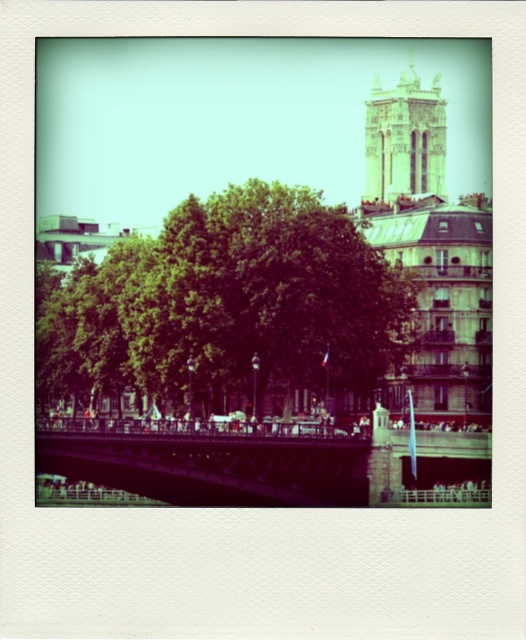
Is metallic bridge at center bigger than golden stone bell tower at upper right?

Incorrect, metallic bridge at center is not larger than golden stone bell tower at upper right.

Is the position of metallic bridge at center less distant than that of golden stone bell tower at upper right?

Yes, metallic bridge at center is closer to the viewer.

Is point (321, 452) more distant than point (377, 115)?

No, it is not.

Where is `metallic bridge at center`? metallic bridge at center is located at coordinates (208, 460).

Is green leafy tree at center bigger than golden stone bell tower at upper right?

No.

Does green leafy tree at center appear under golden stone bell tower at upper right?

Correct, green leafy tree at center is located below golden stone bell tower at upper right.

Locate an element on the screen. This screenshot has height=640, width=526. green leafy tree at center is located at coordinates (227, 307).

Measure the distance between green leafy tree at center and camera.

green leafy tree at center is 243.15 feet away from camera.

Where is `green leafy tree at center`? This screenshot has width=526, height=640. green leafy tree at center is located at coordinates (227, 307).